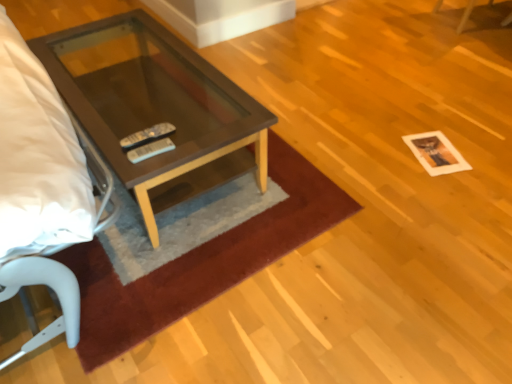
Locate an element on the screen. vacant space in white paper at lower right (from a real-world perspective) is located at coordinates (430, 151).